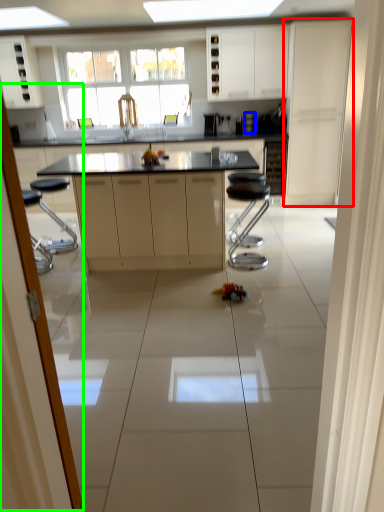
Question: Based on their relative distances, which object is farther from cabinetry (highlighted by a red box)? Choose from appliance (highlighted by a blue box) and screen door (highlighted by a green box).

Choices:
 (A) appliance
 (B) screen door

Answer: (B)